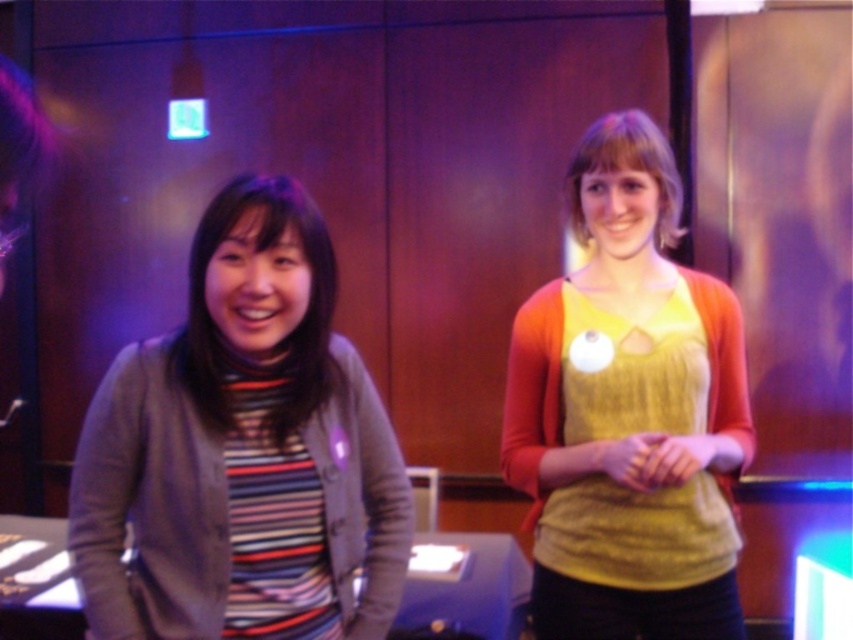
You are organizing a clothing display and need to arrange the striped knit sweater at left and the knitted yellow sweater at center based on their sizes. Which sweater should you place on the lower shelf to ensure proper visibility?

The striped knit sweater at left has a lesser height compared to the knitted yellow sweater at center, so it should be placed on the lower shelf to ensure proper visibility.